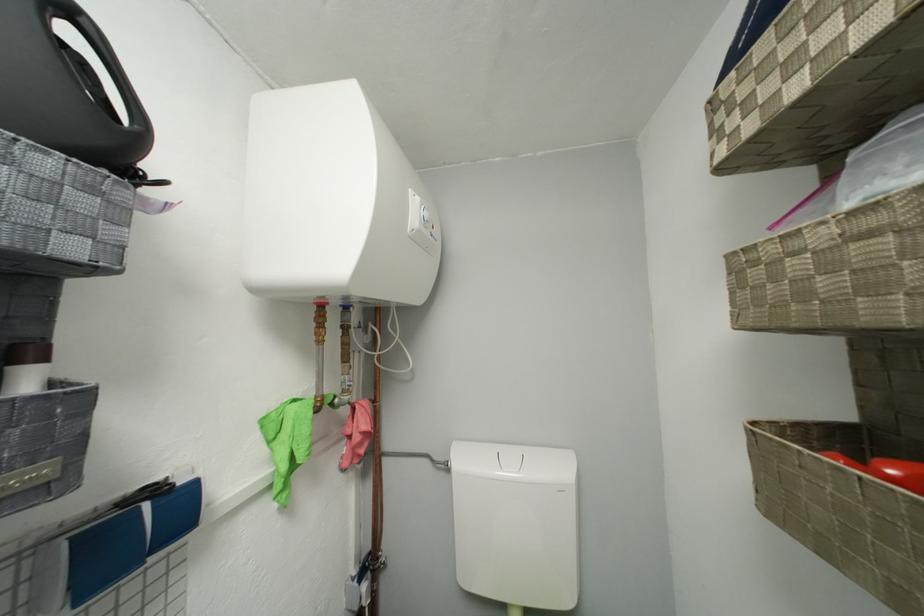
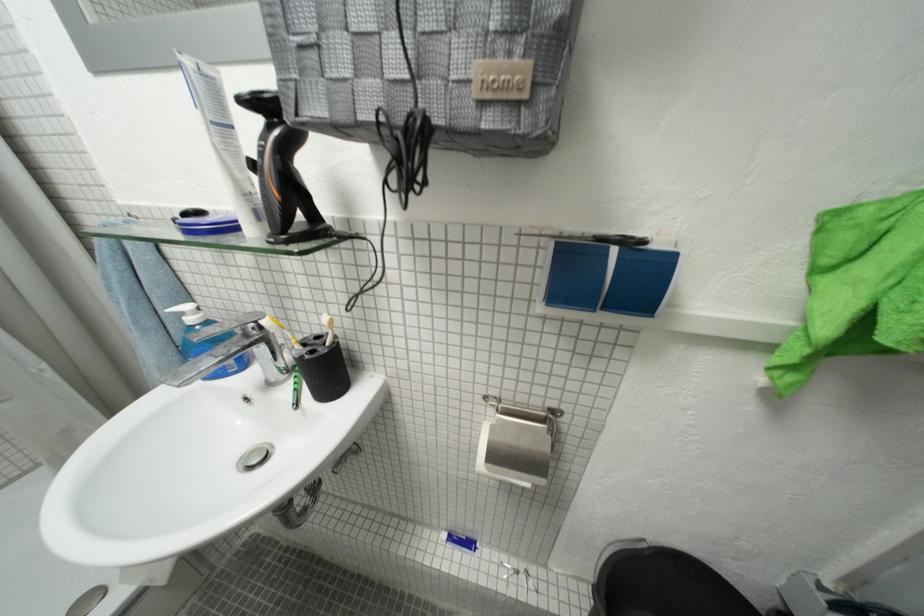
Find the pixel in the second image that matches [32,588] in the first image.

(546, 273)